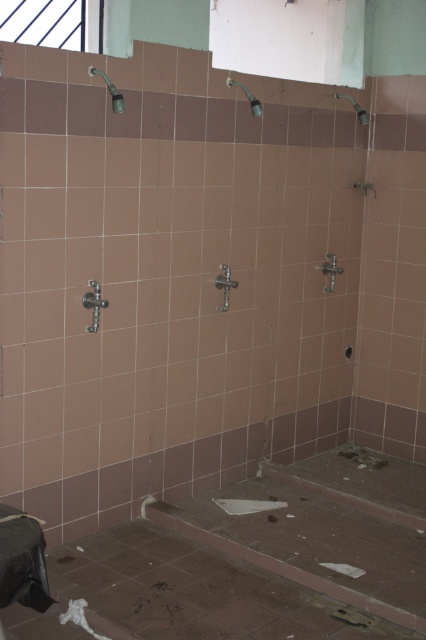
Question: Based on their relative distances, which object is nearer to the metallic silver faucet at center?

Choices:
 (A) matte silver shower head at upper left
 (B) satin nickel faucet at left
 (C) metallic silver faucet at upper center

Answer: (C)

Question: Is satin nickel faucet at left wider than matte silver shower head at upper right?

Choices:
 (A) no
 (B) yes

Answer: (A)

Question: Among these objects, which one is farthest from the camera?

Choices:
 (A) matte silver shower head at upper left
 (B) satin nickel faucet at left
 (C) matte silver shower head at upper right

Answer: (C)

Question: Is metallic silver shower at center above metallic silver faucet at center?

Choices:
 (A) no
 (B) yes

Answer: (A)

Question: Is satin nickel faucet at left below matte silver shower head at upper right?

Choices:
 (A) no
 (B) yes

Answer: (B)

Question: Which point is farther to the camera?

Choices:
 (A) matte silver shower head at upper right
 (B) matte silver shower head at upper left
 (C) metallic silver shower at center

Answer: (A)